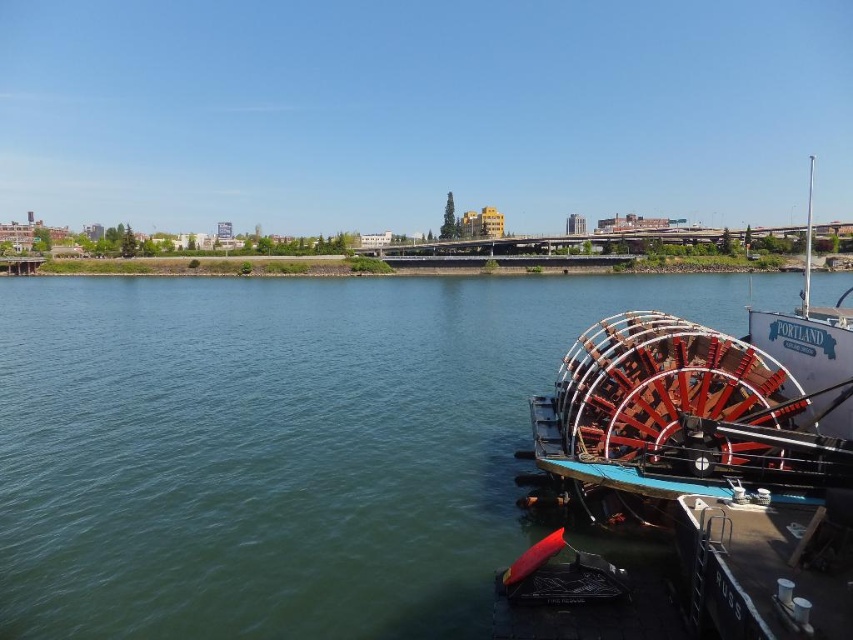
Question: Which of the following is the farthest from the observer?

Choices:
 (A) red polished wood paddlewheel at right
 (B) green smooth water at lower left

Answer: (A)

Question: Does green smooth water at lower left lie behind red polished wood paddlewheel at right?

Choices:
 (A) yes
 (B) no

Answer: (B)

Question: Can you confirm if green smooth water at lower left is positioned to the left of red polished wood paddlewheel at right?

Choices:
 (A) no
 (B) yes

Answer: (B)

Question: Is green smooth water at lower left to the right of red polished wood paddlewheel at right from the viewer's perspective?

Choices:
 (A) yes
 (B) no

Answer: (B)

Question: Which object appears farthest from the camera in this image?

Choices:
 (A) green smooth water at lower left
 (B) red polished wood paddlewheel at right

Answer: (B)

Question: Which point is farther to the camera?

Choices:
 (A) red polished wood paddlewheel at right
 (B) green smooth water at lower left

Answer: (A)